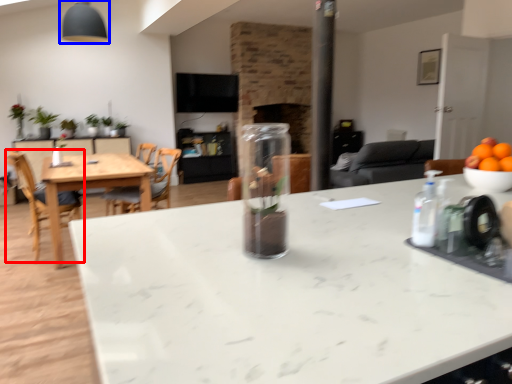
Question: Among these objects, which one is nearest to the camera, chair (highlighted by a red box) or fixture (highlighted by a blue box)?

Choices:
 (A) chair
 (B) fixture

Answer: (A)